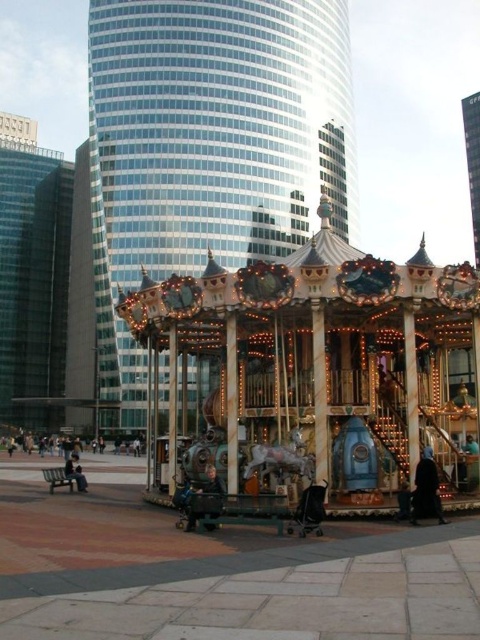
Does dark blue fabric chair at center lie in front of dark blue jeans at lower left?

Yes, dark blue fabric chair at center is in front of dark blue jeans at lower left.

Is dark blue fabric chair at center taller than dark blue jeans at lower left?

No, dark blue fabric chair at center is not taller than dark blue jeans at lower left.

Does point (196, 497) come in front of point (73, 456)?

Yes, it is in front of point (73, 456).

You are a GUI agent. You are given a task and a screenshot of the screen. Output one action in this format:
    pyautogui.click(x=<x>, y=<y>)
    Task: Click on the dark blue fabric chair at center
    The width and height of the screenshot is (480, 640).
    Given the screenshot: What is the action you would take?
    click(x=203, y=493)

Who is positioned more to the left, black fur coat at lower right or dark blue fabric chair at center?

dark blue fabric chair at center

Does point (421, 500) lie behind point (210, 490)?

No.

This screenshot has width=480, height=640. Find the location of `black fur coat at lower right`. black fur coat at lower right is located at coordinates (425, 490).

Locate an element on the screen. The width and height of the screenshot is (480, 640). black fur coat at lower right is located at coordinates (425, 490).

Does wooden carousel at center appear over dark blue jeans at lower left?

Yes, wooden carousel at center is above dark blue jeans at lower left.

Is point (444, 396) positioned in front of point (81, 477)?

That is False.

The image size is (480, 640). I want to click on wooden carousel at center, so click(322, 364).